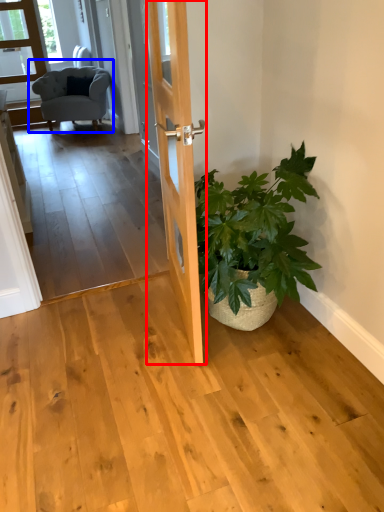
Question: Which object is further to the camera taking this photo, door (highlighted by a red box) or chair (highlighted by a blue box)?

Choices:
 (A) door
 (B) chair

Answer: (B)